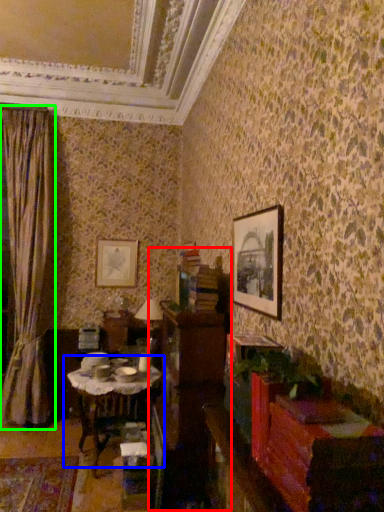
Question: Based on their relative distances, which object is farther from dresser (highlighted by a red box)? Choose from table (highlighted by a blue box) and curtain (highlighted by a green box).

Choices:
 (A) table
 (B) curtain

Answer: (B)